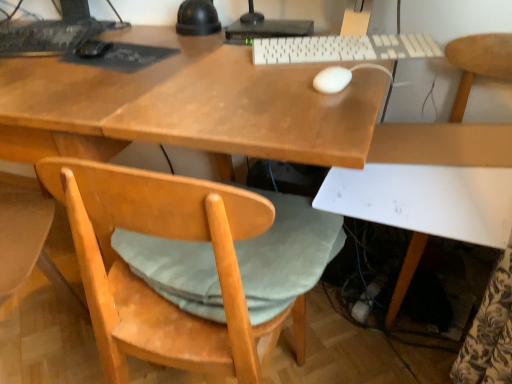
Identify the location of vacant area that lies between white plastic desktop computer at upper center and dark gray matte mousepad at upper left. The height and width of the screenshot is (384, 512). (191, 47).